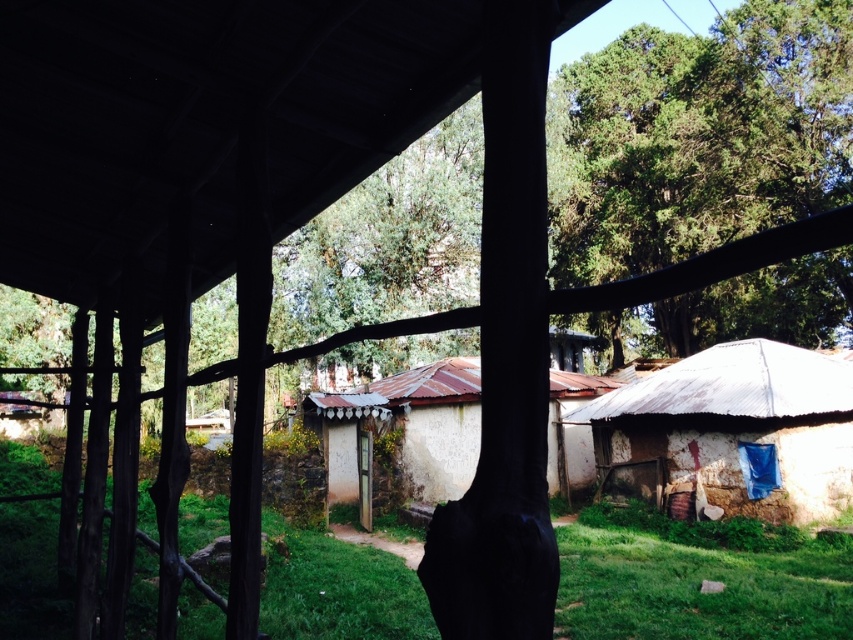
You are standing under a wooden structure and looking down. Where exactly can you see the green grass at lower center?

The green grass at lower center is located at point (697, 588).

You are standing under the wooden structure and looking out. You notice the green leafy tree at upper center and the green grass at lower center. Which object appears bigger in the image?

The green leafy tree at upper center appears bigger than the green grass at lower center because it has a larger size compared to it.